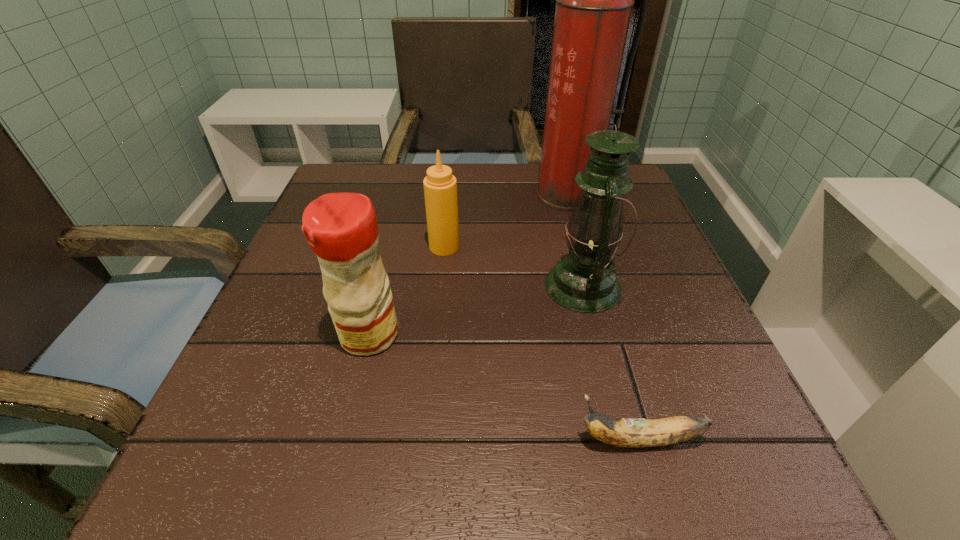
Where is `the farthest object`? The image size is (960, 540). the farthest object is located at coordinates (594, 0).

Identify the location of fire extinguisher. (594, 0).

I want to click on oil lamp, so click(584, 280).

Find the location of a particular element. Image resolution: width=960 pixels, height=540 pixels. the nearer condiment is located at coordinates coord(341,229).

Locate an element on the screen. the left condiment is located at coordinates [341, 229].

Identify the location of the second farthest object. (440, 187).

The image size is (960, 540). Find the location of `the fourth object from right to left`. the fourth object from right to left is located at coordinates (440, 187).

You are a GUI agent. You are given a task and a screenshot of the screen. Output one action in this format:
    pyautogui.click(x=<x>, y=<y>)
    Task: Click on the shortest object
    
    Given the screenshot: What is the action you would take?
    pyautogui.click(x=625, y=432)

Where is `banana`? The width and height of the screenshot is (960, 540). banana is located at coordinates (625, 432).

Locate an element on the screen. Image resolution: width=960 pixels, height=540 pixels. vacant space located 0.170m at the nozzle of the fire extinguisher is located at coordinates (586, 259).